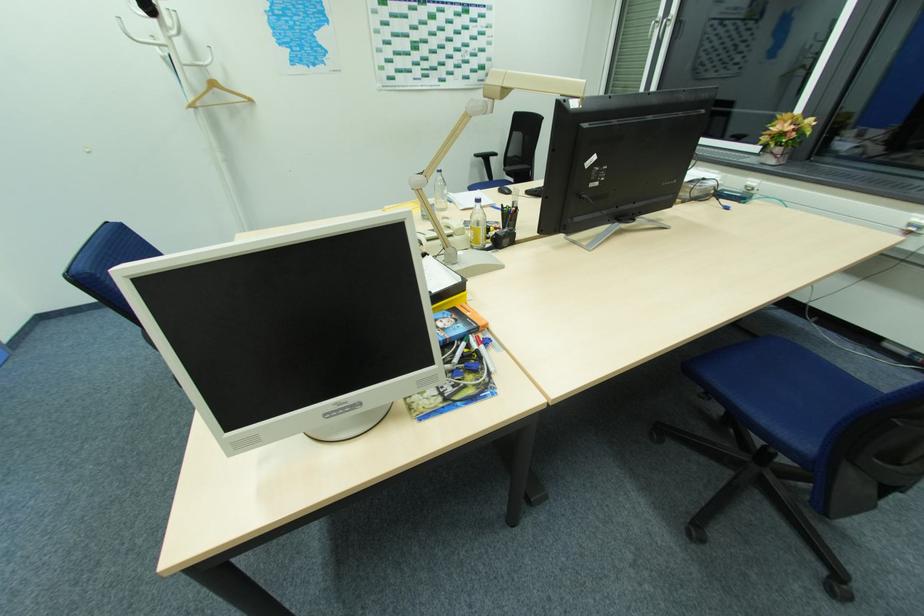
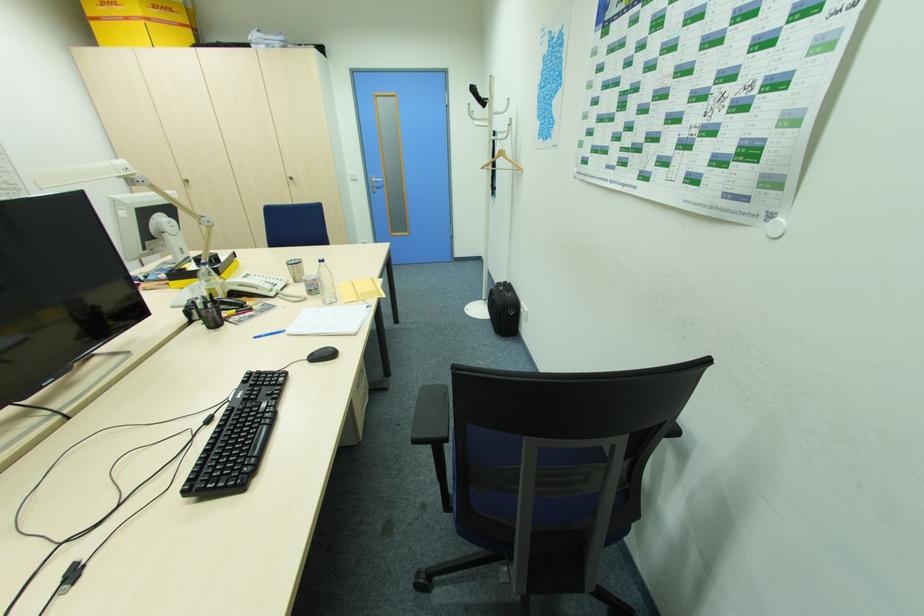
Where in the second image is the point corresponding to (x=166, y=28) from the first image?

(493, 113)